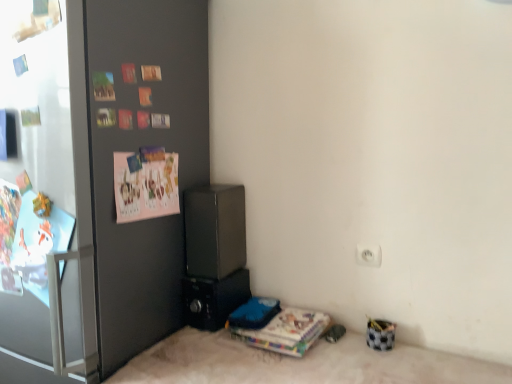
This screenshot has width=512, height=384. Identify the location of free region on the left part of multicolored paper stack at lower center. (199, 351).